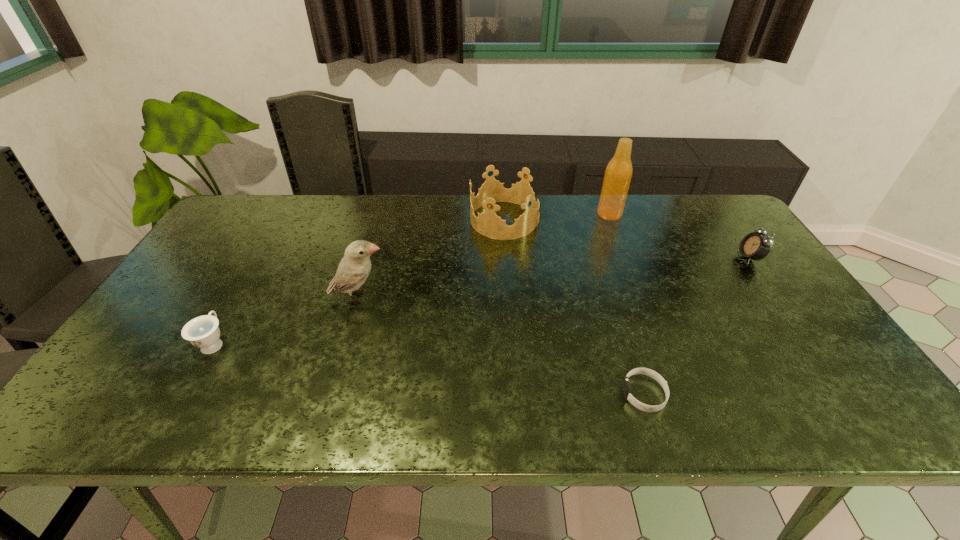
Find the location of a particular element. unoccupied area between the wristband and the alarm clock is located at coordinates (697, 326).

At what (x,y) coordinates should I click in order to perform the action: click on vacant area that lies between the second shortest object and the tallest object. Please return your answer as a coordinate pair (x, y). The image size is (960, 540). Looking at the image, I should click on (412, 279).

At what (x,y) coordinates should I click in order to perform the action: click on vacant space that is in between the second object from left to right and the tallest object. Please return your answer as a coordinate pair (x, y). This screenshot has height=540, width=960. Looking at the image, I should click on (484, 256).

Where is `blank region between the third object from left to right and the second tallest object`? The width and height of the screenshot is (960, 540). blank region between the third object from left to right and the second tallest object is located at coordinates (432, 259).

Locate an element on the screen. empty space between the third object from left to right and the fifth shortest object is located at coordinates (432, 259).

Locate an element on the screen. The height and width of the screenshot is (540, 960). free area in between the third nearest object and the third tallest object is located at coordinates (432, 259).

At what (x,y) coordinates should I click in order to perform the action: click on blank region between the fifth shortest object and the beer bottle. Please return your answer as a coordinate pair (x, y). Looking at the image, I should click on (484, 256).

Point out which object is positioned as the fourth nearest to the shortest object. Please provide its 2D coordinates. Your answer should be formatted as a tuple, i.e. [(x, y)], where the tuple contains the x and y coordinates of a point satisfying the conditions above.

[(618, 173)]

Identify the location of object identified as the second closest to the shortest object. This screenshot has width=960, height=540. (755, 245).

Find the location of a particular element. vacant area in the image that satisfies the following two spatial constraints: 1. on the side of the beer bottle with the handle; 2. on the right side of the leftmost object is located at coordinates (288, 214).